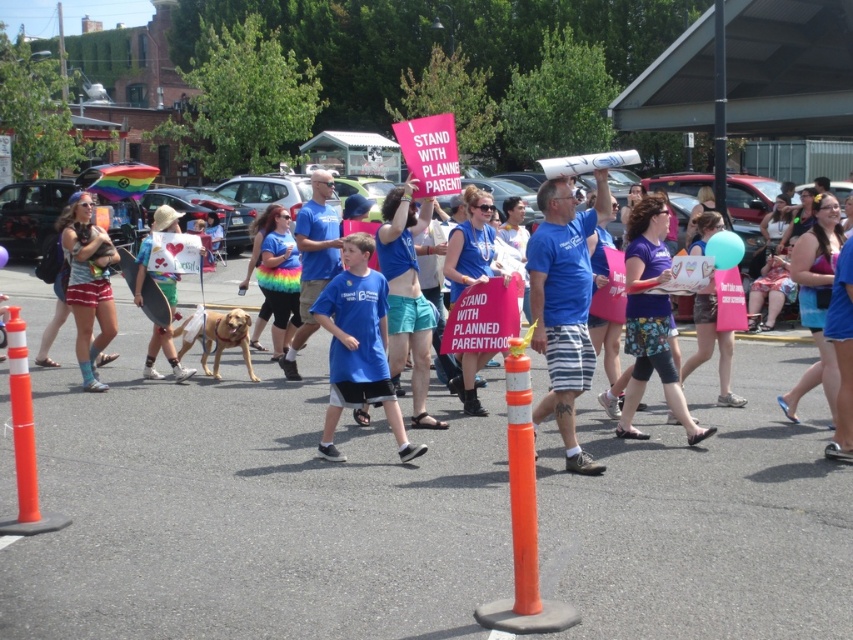
Question: Which object appears closest to the camera in this image?

Choices:
 (A) matte blue t-shirt at center
 (B) golden fur dog at center
 (C) orange plastic traffic cone at center

Answer: (C)

Question: Estimate the real-world distances between objects in this image. Which object is closer to the orange plastic traffic cone at center?

Choices:
 (A) blue cotton shirt at center
 (B) matte blue shorts at left

Answer: (A)

Question: Which object is positioned closest to the orange plastic traffic cone at center?

Choices:
 (A) orange plastic traffic cone at lower left
 (B) camouflage shorts at center
 (C) blue cotton shirt at center
 (D) matte blue t-shirt at center

Answer: (C)

Question: Is matte blue shorts at left wider than golden fur dog at center?

Choices:
 (A) yes
 (B) no

Answer: (B)

Question: Is matte blue t-shirt at center above orange plastic traffic cone at lower left?

Choices:
 (A) yes
 (B) no

Answer: (A)

Question: Where is blue cotton shirt at center located in relation to camouflage shorts at center in the image?

Choices:
 (A) above
 (B) below

Answer: (A)